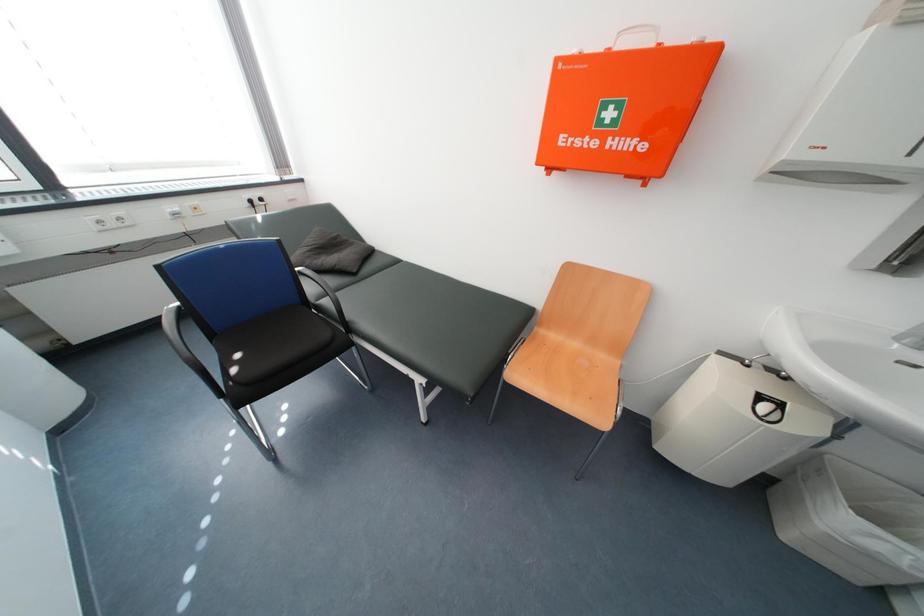
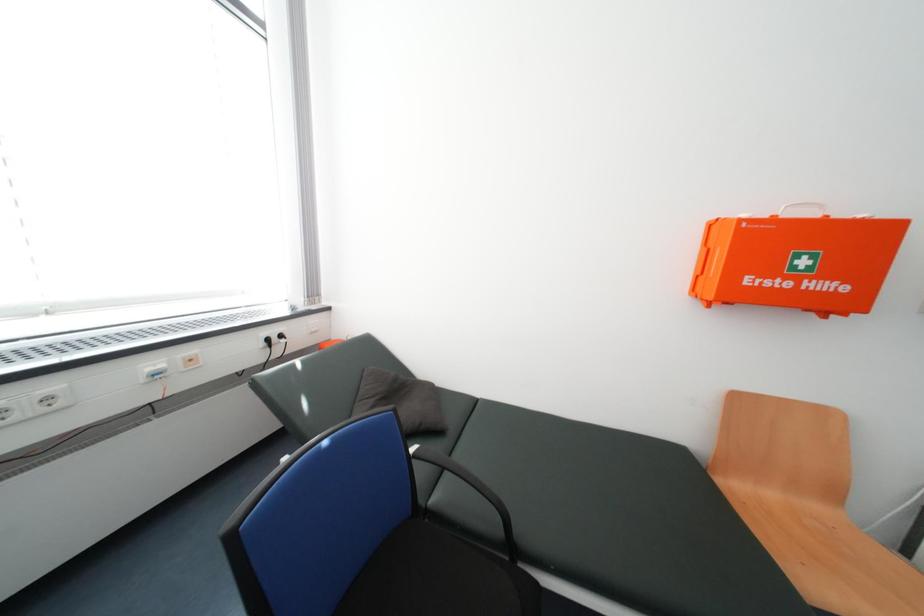
Based on the continuous images, in which direction is the camera rotating?

The camera rotated toward right-up.